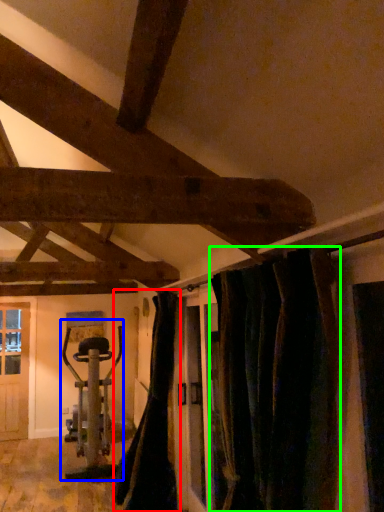
Question: Which is farther away from curtain (highlighted by a red box)? sport equipment (highlighted by a blue box) or curtain (highlighted by a green box)?

Choices:
 (A) sport equipment
 (B) curtain

Answer: (B)